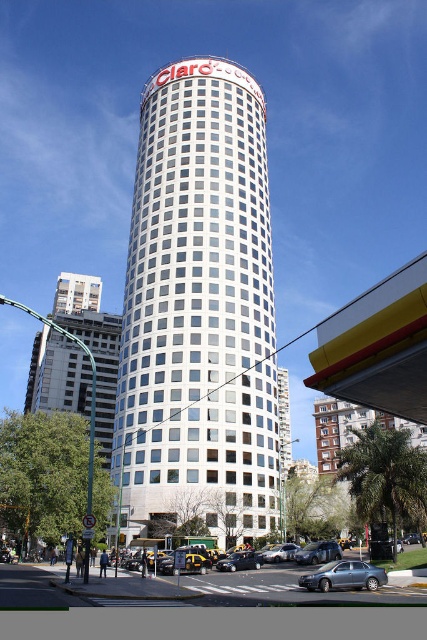
Question: Is gray metallic sedan at lower center to the right of shiny silver sedan at center from the viewer's perspective?

Choices:
 (A) no
 (B) yes

Answer: (B)

Question: Is metallic silver sedan at center bigger than yellow rubber taxi at lower center?

Choices:
 (A) no
 (B) yes

Answer: (B)

Question: Which object appears closest to the camera in this image?

Choices:
 (A) yellow rubber taxi at lower center
 (B) metallic silver sedan at center
 (C) metallic silver car at center

Answer: (A)

Question: Which object is farther from the camera taking this photo?

Choices:
 (A) gray metallic sedan at lower center
 (B) metallic silver car at center

Answer: (B)

Question: Is metallic silver sedan at center closer to the viewer compared to shiny silver sedan at center?

Choices:
 (A) no
 (B) yes

Answer: (A)

Question: Which of the following is the farthest from the observer?

Choices:
 (A) pos(231,184)
 (B) pos(228,556)
 (C) pos(330,544)
 (D) pos(274,545)

Answer: (A)